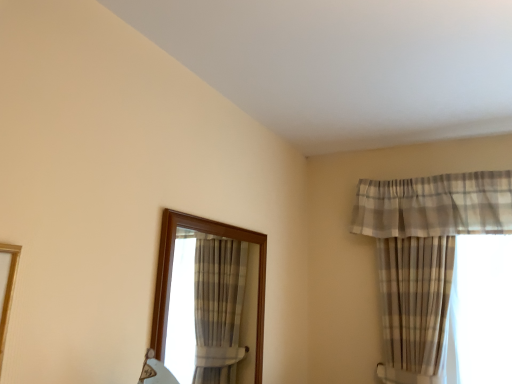
Identify the location of brown wooden mirror at center. The height and width of the screenshot is (384, 512). (170, 272).

What is the approximate height of brown wooden mirror at center?

The height of brown wooden mirror at center is 25.94 inches.

What do you see at coordinates (170, 272) in the screenshot? This screenshot has height=384, width=512. I see `brown wooden mirror at center` at bounding box center [170, 272].

Locate an element on the screen. The width and height of the screenshot is (512, 384). brown wooden mirror at center is located at coordinates (170, 272).